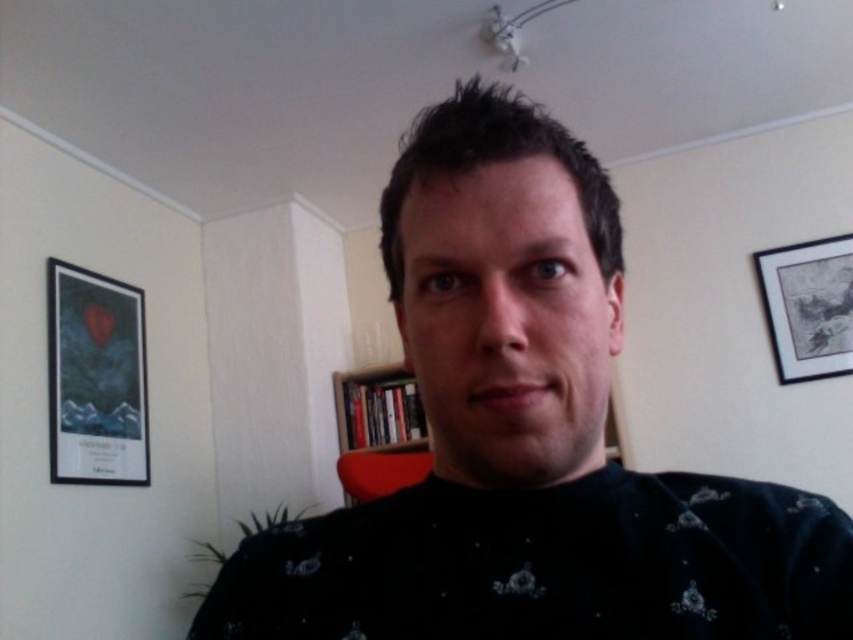
You are organizing a clothing donation drive and need to determine if the dark blue sweater at center can fit into a standard donation box that accommodates items up to the size of the matte black picture frame at upper right. Can the sweater fit?

The dark blue sweater at center has a smaller size compared to the matte black picture frame at upper right, so yes, the sweater can fit into the donation box designed for items up to the size of the matte black picture frame at upper right.

You are a photographer setting up a shot in this room. You want to focus on the matte black picture frame at left while keeping the seated person in the background. Given the distance between the frame and the camera, will you need to adjust your focus to capture both clearly?

The matte black picture frame at left is 2.31 meters away from the camera. Since the seated person is behind the frame, adjusting focus might be necessary to ensure both are clear, but the exact adjustment depends on the camera lens depth of field.

You are a photographer trying to capture a closeup of the dark blue sweater at center. The camera is 11.34 inches away from the sweater. If the camera requires a minimum distance of 12 inches to focus properly, will you be able to take a clear photo?

The dark blue sweater at center and camera are 11.34 inches apart. Since the minimum focusing distance is 12 inches, the camera is too close to take a clear photo.